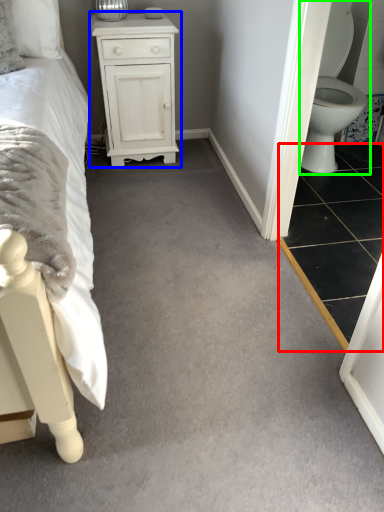
Question: Which is nearer to the tile (highlighted by a red box)? chest of drawers (highlighted by a blue box) or toilet (highlighted by a green box).

Choices:
 (A) chest of drawers
 (B) toilet

Answer: (B)